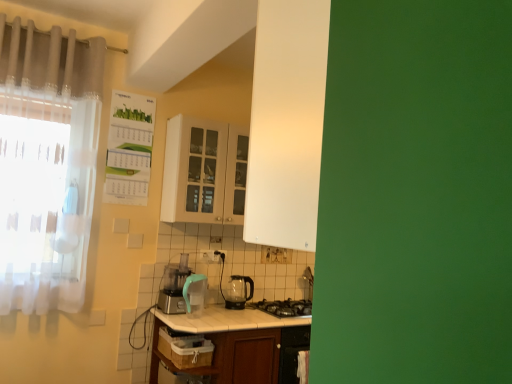
At what (x,y) coordinates should I click in order to perform the action: click on free spot above white sheer curtain at left, which is the 1th curtain in bottom-to-top order (from a real-world perspective). Please return your answer as a coordinate pair (x, y). Image resolution: width=512 pixels, height=384 pixels. Looking at the image, I should click on (52, 94).